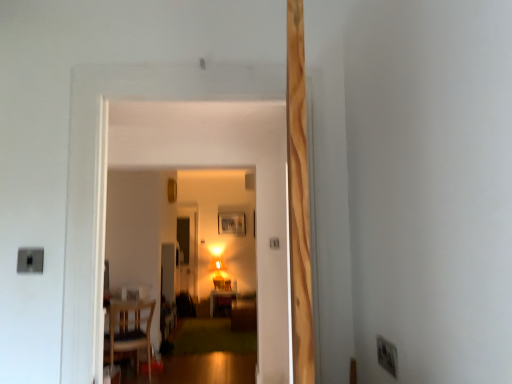
Question: Based on their positions, is matte wooden table at center located to the left or right of white plastic electric outlet at lower right?

Choices:
 (A) right
 (B) left

Answer: (B)

Question: In terms of height, does matte wooden table at center look taller or shorter compared to white plastic electric outlet at lower right?

Choices:
 (A) tall
 (B) short

Answer: (A)

Question: Which object is positioned farthest from the white plastic electric outlet at lower right?

Choices:
 (A) wooden chair at lower left
 (B) wooden picture frame at center
 (C) matte wooden table at center

Answer: (B)

Question: Considering the real-world distances, which object is closest to the white plastic electric outlet at lower right?

Choices:
 (A) wooden picture frame at center
 (B) wooden chair at lower left
 (C) matte wooden table at center

Answer: (B)